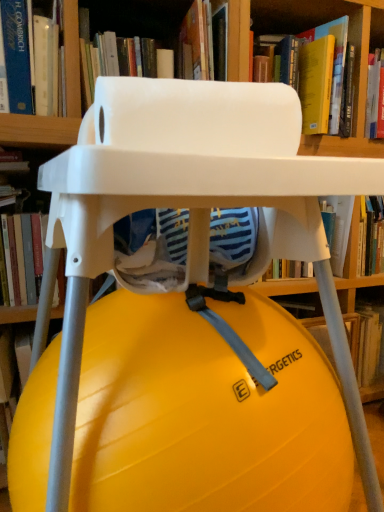
Question: From a real-world perspective, relative to hardcover book at left, which is the first book in left-to-right order, is yellow matte exercise ball at center, acting as the first book starting from the right, vertically above or below?

Choices:
 (A) above
 (B) below

Answer: (B)

Question: Does point (327, 355) appear closer or farther from the camera than point (16, 221)?

Choices:
 (A) farther
 (B) closer

Answer: (B)

Question: Estimate the real-world distances between objects in this image. Which object is farther from the yellow hardcover book at upper center, arranged as the fourth book when viewed from the left?

Choices:
 (A) blue hardcover book at upper left, marked as the 4th book in a right-to-left arrangement
 (B) yellow rubber ball at center
 (C) hardcover book at left, which is the first book in left-to-right order
 (D) white matte book at upper center, the third book in the right-to-left sequence
 (E) yellow matte exercise ball at center, the fifth book viewed from the left

Answer: (B)

Question: Which is nearer to the yellow rubber ball at center?

Choices:
 (A) blue hardcover book at upper left, marked as the 4th book in a right-to-left arrangement
 (B) yellow matte exercise ball at center, the fifth book viewed from the left
 (C) hardcover book at left, which appears as the 5th book when viewed from the right
 (D) yellow hardcover book at upper center, arranged as the fourth book when viewed from the left
 (E) white matte book at upper center, which ranks as the 3th book in left-to-right order

Answer: (C)